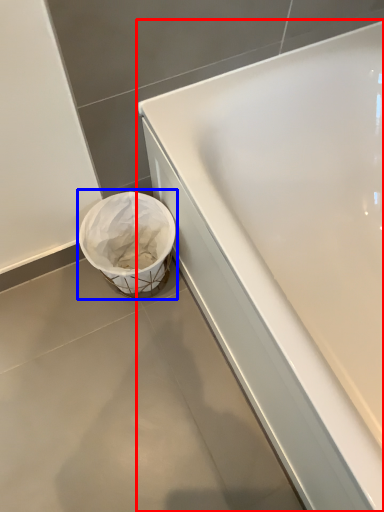
Question: Which object appears farthest to the camera in this image, bathtub (highlighted by a red box) or waste container (highlighted by a blue box)?

Choices:
 (A) bathtub
 (B) waste container

Answer: (B)